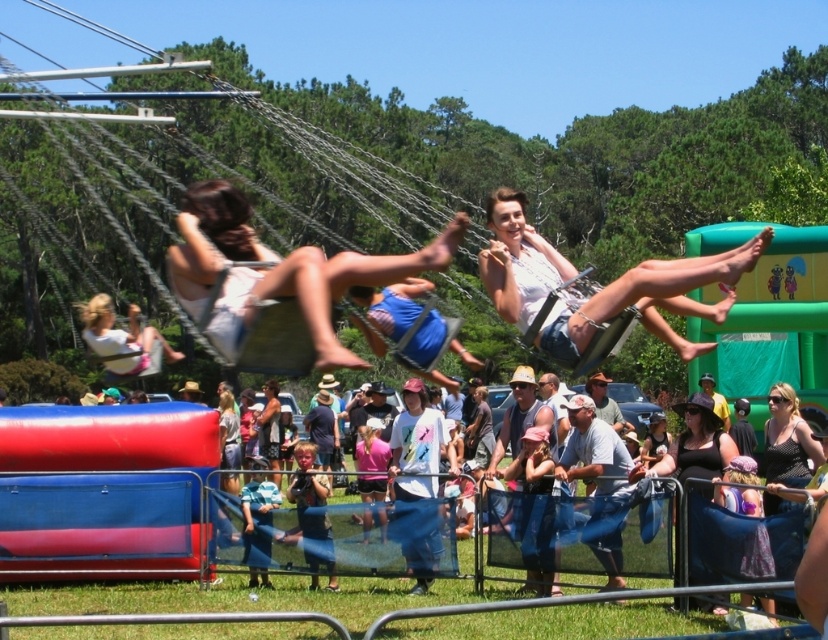
Question: Based on their relative distances, which object is nearer to the black dotted tank top at lower right?

Choices:
 (A) matte black tank top at center
 (B) denim jeans at lower center
 (C) white fabric dress at center
 (D) white cotton shirt at center

Answer: (A)

Question: Among these objects, which one is nearest to the camera?

Choices:
 (A) white fabric dress at center
 (B) denim jeans at lower center
 (C) matte black tank top at center

Answer: (B)

Question: Is denim jeans at lower center thinner than white cotton shirt at center?

Choices:
 (A) no
 (B) yes

Answer: (A)

Question: Is white cotton shirt at center closer to camera compared to black dotted tank top at lower right?

Choices:
 (A) yes
 (B) no

Answer: (A)

Question: Among these points, which one is nearest to the camera?

Choices:
 (A) [x=297, y=556]
 (B) [x=504, y=236]
 (C) [x=763, y=493]

Answer: (B)

Question: Is white cotton shirt at center to the right of matte black tank top at center from the viewer's perspective?

Choices:
 (A) yes
 (B) no

Answer: (A)